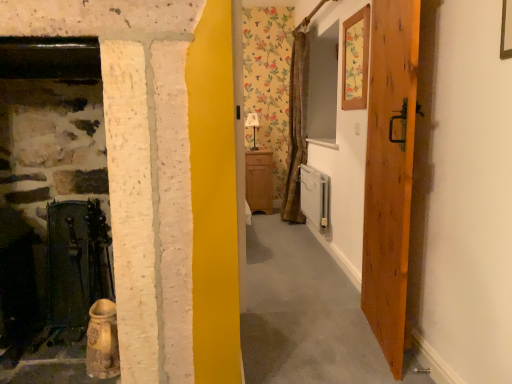
Question: Does matte white lamp at center contain wooden door at right?

Choices:
 (A) yes
 (B) no

Answer: (B)

Question: Is there a large distance between matte white lamp at center and wooden door at right?

Choices:
 (A) no
 (B) yes

Answer: (B)

Question: From the image's perspective, is matte white lamp at center above wooden door at right?

Choices:
 (A) no
 (B) yes

Answer: (B)

Question: From a real-world perspective, is matte white lamp at center below wooden door at right?

Choices:
 (A) no
 (B) yes

Answer: (A)

Question: Considering the relative sizes of matte white lamp at center and wooden door at right in the image provided, is matte white lamp at center wider than wooden door at right?

Choices:
 (A) no
 (B) yes

Answer: (B)

Question: Is point (318, 203) positioned closer to the camera than point (345, 79)?

Choices:
 (A) closer
 (B) farther

Answer: (B)

Question: Choose the correct answer: Is white glossy radiator at lower right inside wooden picture frame at upper right or outside it?

Choices:
 (A) inside
 (B) outside

Answer: (B)

Question: Relative to wooden picture frame at upper right, is white glossy radiator at lower right in front or behind?

Choices:
 (A) behind
 (B) front

Answer: (A)

Question: From a real-world perspective, is white glossy radiator at lower right above or below wooden picture frame at upper right?

Choices:
 (A) above
 (B) below

Answer: (B)

Question: From a real-world perspective, is matte wood cabinet at center above or below matte white lamp at center?

Choices:
 (A) above
 (B) below

Answer: (B)

Question: In terms of height, does matte wood cabinet at center look taller or shorter compared to matte white lamp at center?

Choices:
 (A) tall
 (B) short

Answer: (A)

Question: Visually, is matte wood cabinet at center positioned to the left or to the right of matte white lamp at center?

Choices:
 (A) right
 (B) left

Answer: (A)

Question: Does point (256, 200) appear closer or farther from the camera than point (247, 119)?

Choices:
 (A) farther
 (B) closer

Answer: (A)

Question: Considering the positions of wooden picture frame at upper right and matte wood cabinet at center in the image, is wooden picture frame at upper right bigger or smaller than matte wood cabinet at center?

Choices:
 (A) small
 (B) big

Answer: (A)

Question: From their relative heights in the image, would you say wooden picture frame at upper right is taller or shorter than matte wood cabinet at center?

Choices:
 (A) short
 (B) tall

Answer: (A)